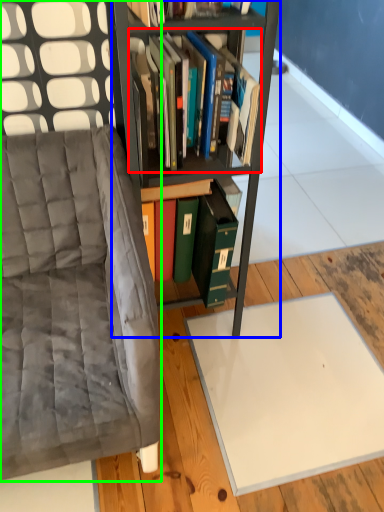
Question: Which object is the farthest from book (highlighted by a red box)? Choose among these: bookcase (highlighted by a blue box) or chair (highlighted by a green box).

Choices:
 (A) bookcase
 (B) chair

Answer: (B)